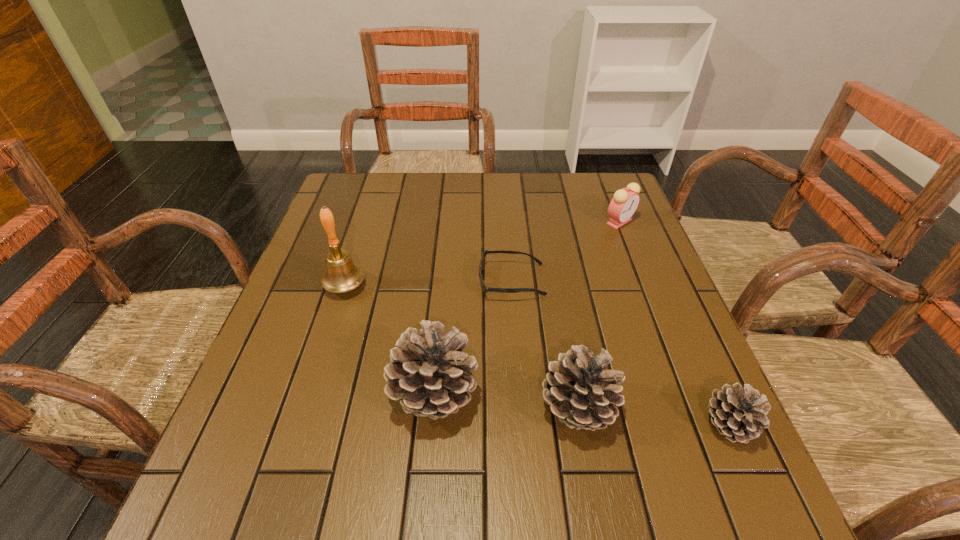
Where is `free spot located on the left of the shortest pinecone`? free spot located on the left of the shortest pinecone is located at coordinates (530, 424).

The width and height of the screenshot is (960, 540). I want to click on free space located on the face of the farthest object, so click(x=633, y=254).

What are the coordinates of `blank space located on the front-facing side of the shortest object` in the screenshot? It's located at (372, 281).

Where is `vacant area located 0.330m on the front-facing side of the shortest object`? vacant area located 0.330m on the front-facing side of the shortest object is located at coordinates click(343, 281).

You are a GUI agent. You are given a task and a screenshot of the screen. Output one action in this format:
    pyautogui.click(x=<x>, y=<y>)
    Task: Click on the free region located 0.260m on the front-facing side of the shortest object
    
    Given the screenshot: What is the action you would take?
    pyautogui.click(x=372, y=281)

Where is `vacant area located on the back of the leftmost object`? vacant area located on the back of the leftmost object is located at coordinates (363, 231).

You are a GUI agent. You are given a task and a screenshot of the screen. Output one action in this format:
    pyautogui.click(x=<x>, y=<y>)
    Task: Click on the object that is positioned at the far edge
    
    Given the screenshot: What is the action you would take?
    pyautogui.click(x=623, y=205)

Identify the location of object that is at the left edge. pos(342,275).

The height and width of the screenshot is (540, 960). I want to click on pinecone present at the right edge, so click(739, 414).

At what (x,y) coordinates should I click in order to perform the action: click on alarm clock at the right edge. Please return your answer as a coordinate pair (x, y). The width and height of the screenshot is (960, 540). Looking at the image, I should click on (623, 205).